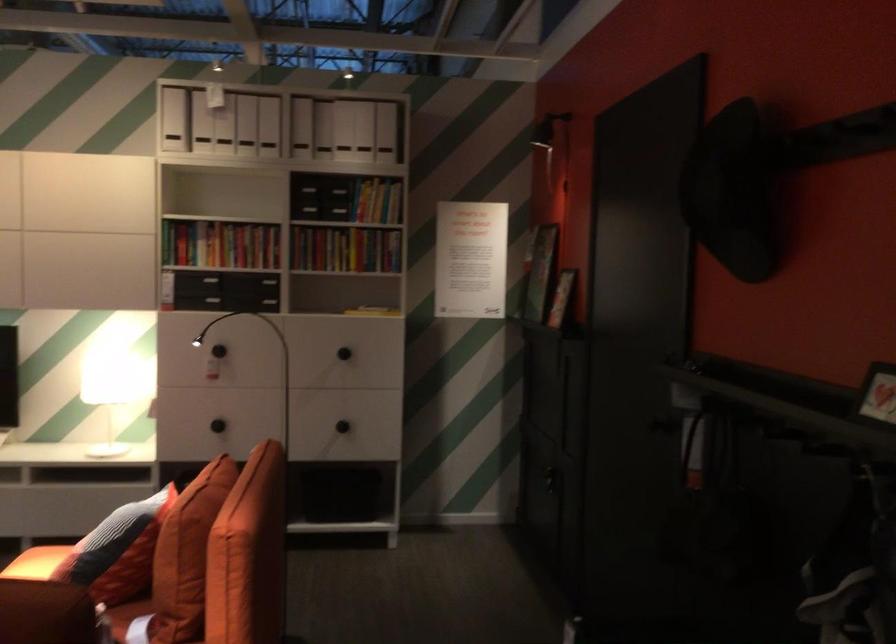
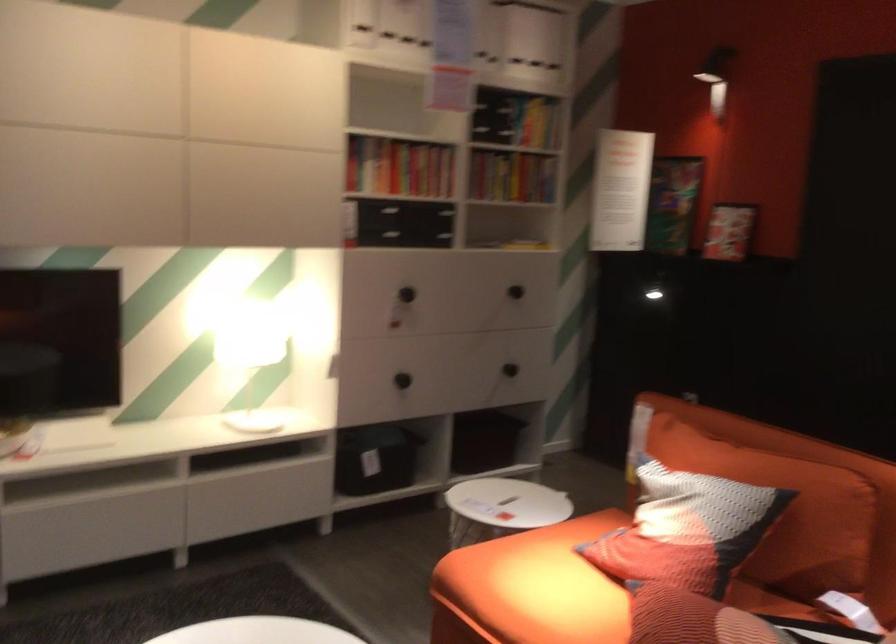
Where in the second image is the point corresponding to the point at 300,140 from the first image?

(494, 39)